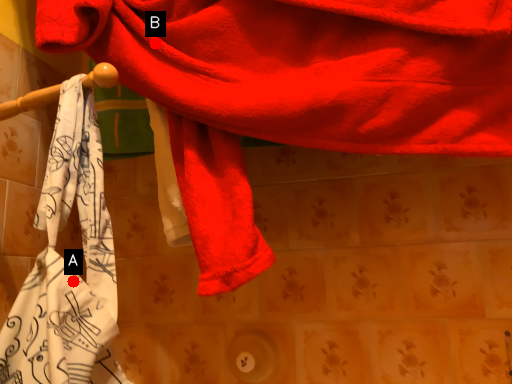
Question: Two points are circled on the image, labeled by A and B beside each circle. Which of the following is the closest to the observer?

Choices:
 (A) A is closer
 (B) B is closer

Answer: (A)